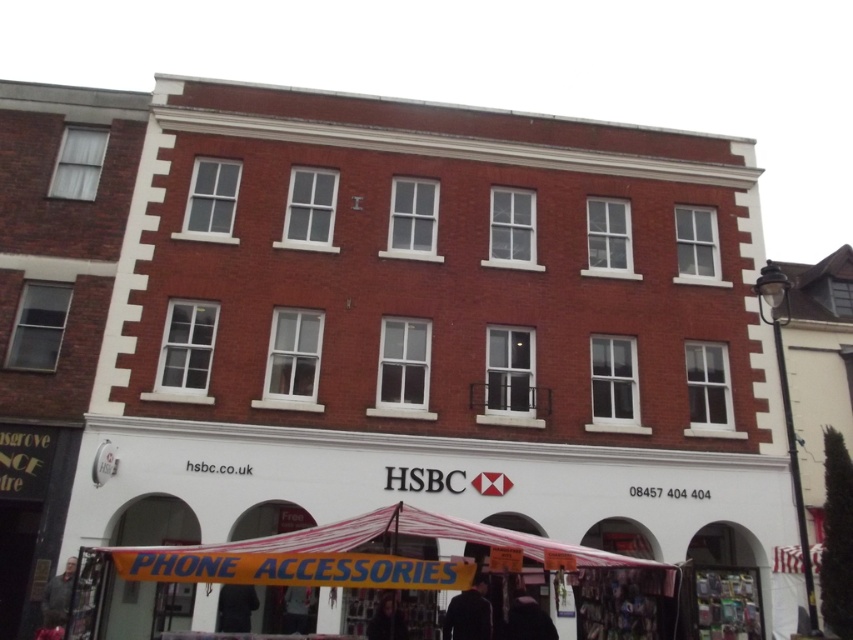
Which is more to the left, yellow fabric canopy at lower center or dark gray jacket at lower left?

Positioned to the left is dark gray jacket at lower left.

Is yellow fabric canopy at lower center in front of dark gray jacket at lower left?

Yes, it is in front of dark gray jacket at lower left.

Which is in front, point (178, 561) or point (61, 625)?

Positioned in front is point (178, 561).

The width and height of the screenshot is (853, 640). Identify the location of yellow fabric canopy at lower center. (354, 548).

Is point (421, 509) less distant than point (555, 632)?

No, it is not.

Which is more to the right, yellow fabric canopy at lower center or dark fabric jacket at lower center?

dark fabric jacket at lower center is more to the right.

Does point (193, 557) lie in front of point (519, 604)?

Yes, it is in front of point (519, 604).

What are the coordinates of `yellow fabric canopy at lower center` in the screenshot? It's located at (354, 548).

Can you confirm if yellow fabric canopy at lower center is positioned above dark hair at lower center?

Indeed, yellow fabric canopy at lower center is positioned over dark hair at lower center.

Which is behind, point (268, 577) or point (398, 632)?

Positioned behind is point (398, 632).

Is point (397, 524) more distant than point (396, 620)?

No, (397, 524) is closer to viewer.

At what (x,y) coordinates should I click in order to perform the action: click on yellow fabric canopy at lower center. Please return your answer as a coordinate pair (x, y). Looking at the image, I should click on (354, 548).